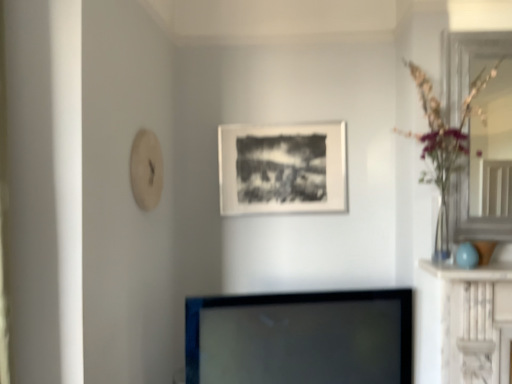
Question: Considering the relative positions of clear glass door at right and black glossy tv at center in the image provided, is clear glass door at right in front of black glossy tv at center?

Choices:
 (A) yes
 (B) no

Answer: (B)

Question: Could you tell me if clear glass door at right is turned towards black glossy tv at center?

Choices:
 (A) no
 (B) yes

Answer: (A)

Question: Considering the relative positions of clear glass door at right and black glossy tv at center in the image provided, is clear glass door at right behind black glossy tv at center?

Choices:
 (A) no
 (B) yes

Answer: (B)

Question: Is clear glass door at right positioned with its back to black glossy tv at center?

Choices:
 (A) yes
 (B) no

Answer: (B)

Question: From a real-world perspective, is clear glass door at right beneath black glossy tv at center?

Choices:
 (A) yes
 (B) no

Answer: (B)

Question: Is black glossy tv at center inside clear glass door at right?

Choices:
 (A) yes
 (B) no

Answer: (B)

Question: Is black glossy tv at center positioned with its back to matte black picture frame at center?

Choices:
 (A) no
 (B) yes

Answer: (A)

Question: Would you say black glossy tv at center is outside matte black picture frame at center?

Choices:
 (A) yes
 (B) no

Answer: (A)

Question: From a real-world perspective, is black glossy tv at center physically below matte black picture frame at center?

Choices:
 (A) no
 (B) yes

Answer: (B)

Question: Is black glossy tv at center positioned in front of matte black picture frame at center?

Choices:
 (A) yes
 (B) no

Answer: (A)

Question: Is black glossy tv at center smaller than matte black picture frame at center?

Choices:
 (A) yes
 (B) no

Answer: (B)

Question: From the image's perspective, does black glossy tv at center appear higher than matte black picture frame at center?

Choices:
 (A) yes
 (B) no

Answer: (B)

Question: Considering the relative positions of matte black picture frame at center and clear glass vase at right in the image provided, is matte black picture frame at center to the right of clear glass vase at right from the viewer's perspective?

Choices:
 (A) no
 (B) yes

Answer: (A)